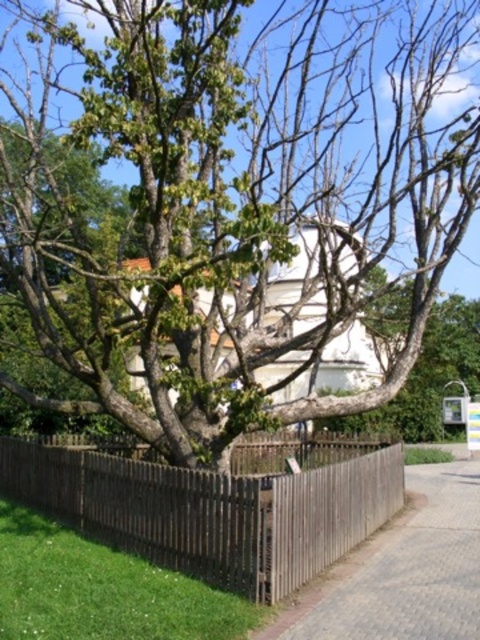
Question: Among these objects, which one is nearest to the camera?

Choices:
 (A) green leafy tree at center
 (B) brown wooden fence at lower center

Answer: (A)

Question: Can you confirm if green leafy tree at center is positioned to the left of brown wooden fence at lower center?

Choices:
 (A) no
 (B) yes

Answer: (A)

Question: Which of the following is the farthest from the observer?

Choices:
 (A) (446, 172)
 (B) (206, 577)

Answer: (A)

Question: Does green leafy tree at center appear on the left side of brown wooden fence at lower center?

Choices:
 (A) yes
 (B) no

Answer: (B)

Question: Does green leafy tree at center come behind brown wooden fence at lower center?

Choices:
 (A) no
 (B) yes

Answer: (A)